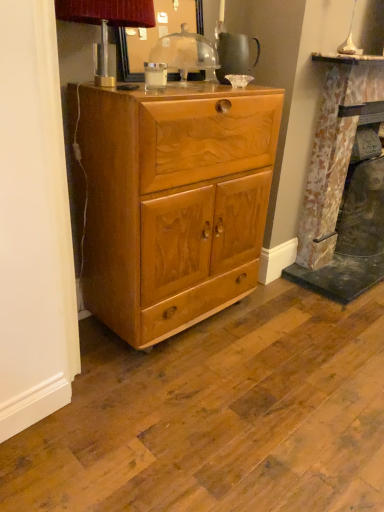
Question: Considering the relative sizes of rustic stone fireplace at right and glossy wooden mirror at upper center in the image provided, is rustic stone fireplace at right taller than glossy wooden mirror at upper center?

Choices:
 (A) no
 (B) yes

Answer: (B)

Question: From the image's perspective, would you say rustic stone fireplace at right is positioned over glossy wooden mirror at upper center?

Choices:
 (A) yes
 (B) no

Answer: (B)

Question: Does rustic stone fireplace at right come behind glossy wooden mirror at upper center?

Choices:
 (A) yes
 (B) no

Answer: (A)

Question: Is rustic stone fireplace at right in front of glossy wooden mirror at upper center?

Choices:
 (A) yes
 (B) no

Answer: (B)

Question: From a real-world perspective, does rustic stone fireplace at right sit lower than glossy wooden mirror at upper center?

Choices:
 (A) no
 (B) yes

Answer: (B)

Question: Is rustic stone fireplace at right directly adjacent to glossy wooden mirror at upper center?

Choices:
 (A) yes
 (B) no

Answer: (B)

Question: Is light brown wood cabinet at center to the right of glossy wooden mirror at upper center from the viewer's perspective?

Choices:
 (A) no
 (B) yes

Answer: (B)

Question: Is light brown wood cabinet at center aimed at glossy wooden mirror at upper center?

Choices:
 (A) yes
 (B) no

Answer: (B)

Question: Does light brown wood cabinet at center have a larger size compared to glossy wooden mirror at upper center?

Choices:
 (A) no
 (B) yes

Answer: (B)

Question: From a real-world perspective, does light brown wood cabinet at center stand above glossy wooden mirror at upper center?

Choices:
 (A) no
 (B) yes

Answer: (A)

Question: Is light brown wood cabinet at center thinner than glossy wooden mirror at upper center?

Choices:
 (A) no
 (B) yes

Answer: (A)

Question: Can you confirm if light brown wood cabinet at center is smaller than glossy wooden mirror at upper center?

Choices:
 (A) no
 (B) yes

Answer: (A)

Question: Is rustic stone fireplace at right further to the viewer compared to metallic silver table lamp at upper left, arranged as the second table lamp when viewed from the right?

Choices:
 (A) no
 (B) yes

Answer: (B)